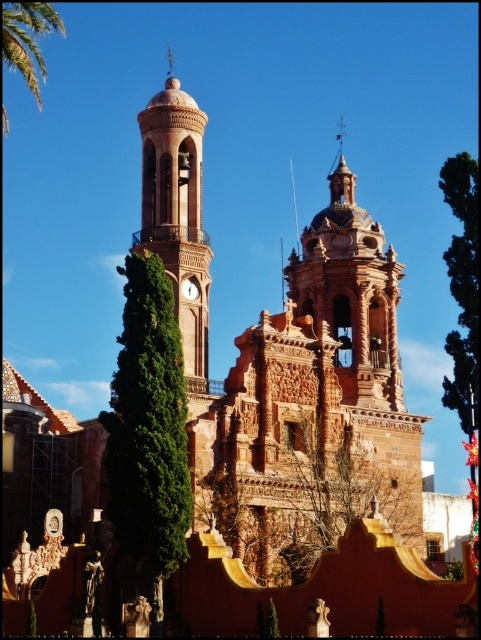
From the picture: Which is above, smooth terracotta bell tower at center or green leafy tree at upper right?

smooth terracotta bell tower at center

Can you confirm if smooth terracotta bell tower at center is positioned to the right of green leafy tree at upper right?

Incorrect, smooth terracotta bell tower at center is not on the right side of green leafy tree at upper right.

What do you see at coordinates (177, 214) in the screenshot? I see `smooth terracotta bell tower at center` at bounding box center [177, 214].

Find the location of a particular element. The width and height of the screenshot is (481, 640). smooth terracotta bell tower at center is located at coordinates (177, 214).

Is green leafy tree at upper right taller than green leafy palm tree at upper left?

Indeed, green leafy tree at upper right has a greater height compared to green leafy palm tree at upper left.

Is green leafy tree at upper right above green leafy palm tree at upper left?

No, green leafy tree at upper right is not above green leafy palm tree at upper left.

This screenshot has height=640, width=481. Find the location of `green leafy tree at upper right`. green leafy tree at upper right is located at coordinates (463, 284).

Between green leafy tree at center and green leafy tree at upper right, which one is positioned lower?

Positioned lower is green leafy tree at center.

Can you confirm if green leafy tree at center is taller than green leafy tree at upper right?

In fact, green leafy tree at center may be shorter than green leafy tree at upper right.

Who is more distant from viewer, (113, 474) or (475, 387)?

The point (475, 387) is behind.

You are a GUI agent. You are given a task and a screenshot of the screen. Output one action in this format:
    pyautogui.click(x=<x>, y=<y>)
    Task: Click on the green leafy tree at center
    This screenshot has width=481, height=640.
    Given the screenshot: What is the action you would take?
    tap(149, 429)